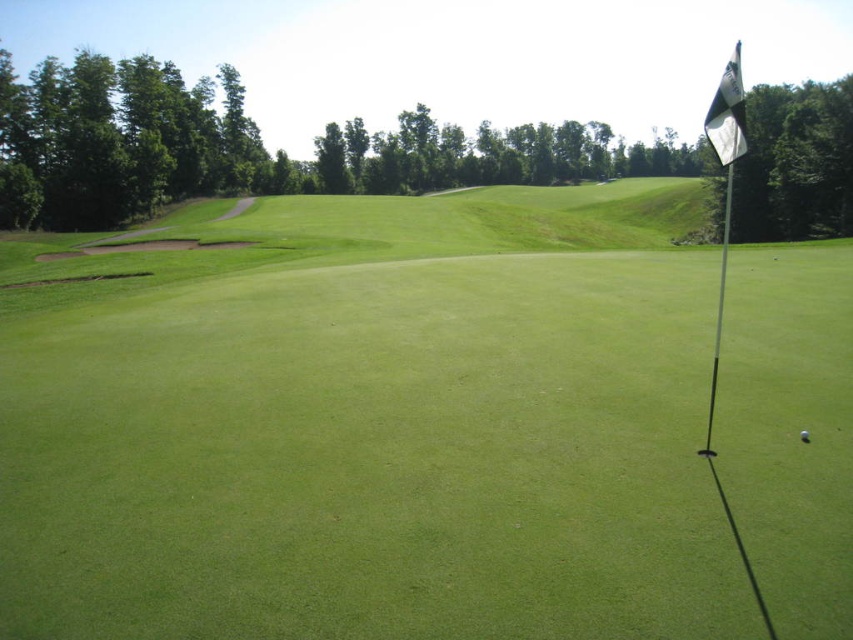
You are standing at the point closer to the camera in this golf course scene. There are two points marked on the image, one at coordinates point (672,401) and another at point (727,74). Which point are you standing at?

You are standing at point (727,74) because it is closer to the camera than point (672,401).

You are a golfer standing at the edge of the putting green and want to determine the distance between the two points marked on the golf course. Which point is closer to you, point (726, 147) or point (802, 435)?

Point (726, 147) is closer to you than point (802, 435).

You are a golfer standing on the green grassy golf course at center and want to hit the ball towards the white fabric flag at upper right. Can you see the flag from your current position?

The green grassy golf course at center is smaller than white fabric flag at upper right, so yes, you can see the white fabric flag at upper right from your position on the green grassy golf course at center because it is larger and more prominent in the frame.